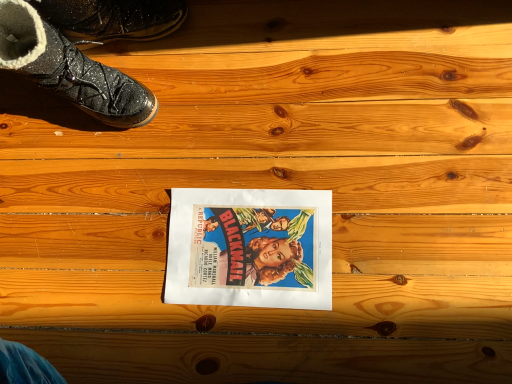
Find the location of a particular element. empty space that is ontop of matte paper movie poster at center (from a real-world perspective) is located at coordinates (248, 242).